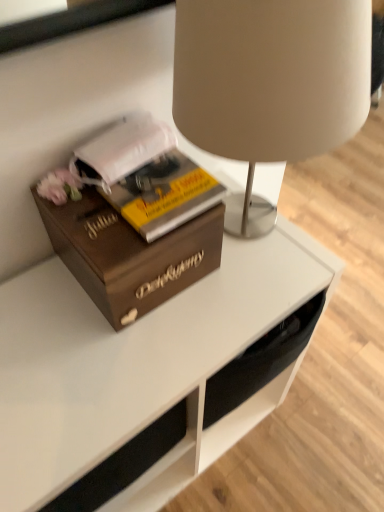
Question: From the image's perspective, is white matte book at left on wooden box at left?

Choices:
 (A) no
 (B) yes

Answer: (B)

Question: Is wooden box at left completely or partially inside white matte book at left?

Choices:
 (A) no
 (B) yes

Answer: (A)

Question: Considering the relative sizes of white matte book at left and wooden box at left in the image provided, is white matte book at left taller than wooden box at left?

Choices:
 (A) no
 (B) yes

Answer: (A)

Question: Is white matte book at left not within wooden box at left?

Choices:
 (A) no
 (B) yes

Answer: (A)

Question: Can you confirm if white matte book at left is positioned to the left of wooden box at left?

Choices:
 (A) yes
 (B) no

Answer: (A)

Question: Is white matte book at left shorter than wooden box at left?

Choices:
 (A) yes
 (B) no

Answer: (A)

Question: Could you tell me if wooden box at left is turned towards matte beige lampshade at upper center?

Choices:
 (A) yes
 (B) no

Answer: (B)

Question: Is wooden box at left not inside matte beige lampshade at upper center?

Choices:
 (A) no
 (B) yes

Answer: (B)

Question: From the image's perspective, is wooden box at left above matte beige lampshade at upper center?

Choices:
 (A) no
 (B) yes

Answer: (A)

Question: Is wooden box at left positioned in front of matte beige lampshade at upper center?

Choices:
 (A) no
 (B) yes

Answer: (A)

Question: From a real-world perspective, is wooden box at left located beneath matte beige lampshade at upper center?

Choices:
 (A) yes
 (B) no

Answer: (A)

Question: Can you confirm if wooden box at left is wider than matte beige lampshade at upper center?

Choices:
 (A) no
 (B) yes

Answer: (A)

Question: Considering the relative sizes of matte beige lampshade at upper center and wooden box at left in the image provided, is matte beige lampshade at upper center smaller than wooden box at left?

Choices:
 (A) no
 (B) yes

Answer: (A)